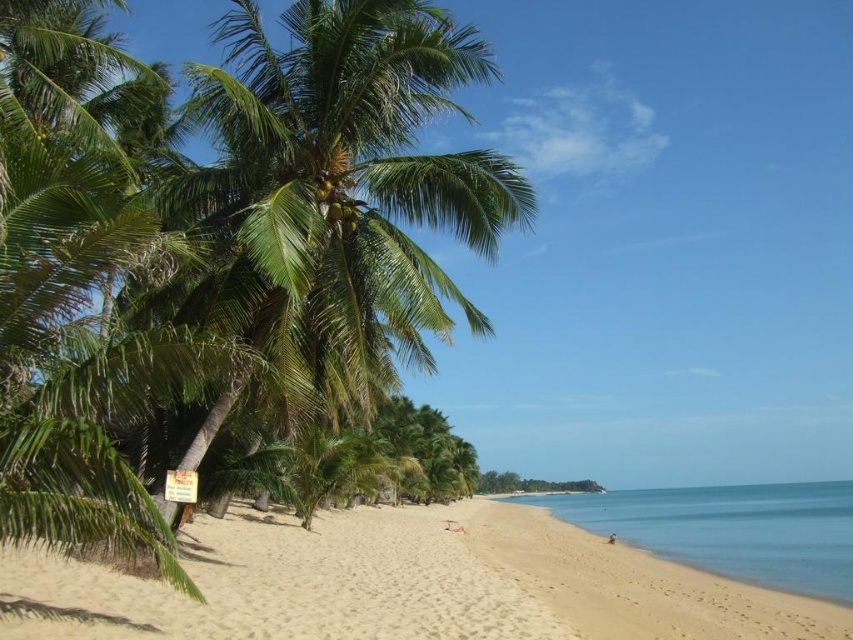
Question: Does beige sandy beach at center have a lesser width compared to white sandy beach at lower right?

Choices:
 (A) no
 (B) yes

Answer: (A)

Question: Which object appears closest to the camera in this image?

Choices:
 (A) white sandy beach at lower right
 (B) beige sandy beach at center

Answer: (B)

Question: Is beige sandy beach at center positioned before white sandy beach at lower right?

Choices:
 (A) yes
 (B) no

Answer: (A)

Question: Which point is closer to the camera taking this photo?

Choices:
 (A) (761, 596)
 (B) (579, 618)
 (C) (328, 260)

Answer: (C)

Question: Which object is the closest to the green leafy coconut tree at left?

Choices:
 (A) white sandy beach at lower right
 (B) beige sandy beach at center

Answer: (B)

Question: Is green leafy coconut tree at left smaller than white sandy beach at lower right?

Choices:
 (A) yes
 (B) no

Answer: (B)